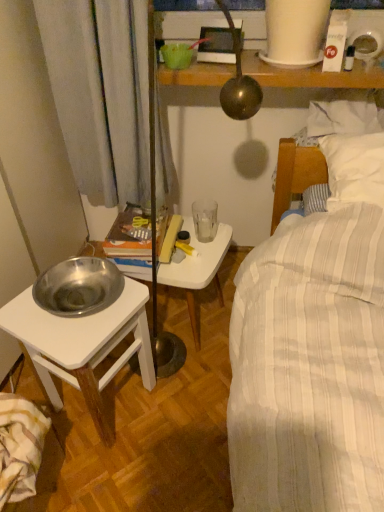
Question: Does white plastic table at center have a lesser width compared to striped cotton blanket at lower left?

Choices:
 (A) no
 (B) yes

Answer: (A)

Question: From the image's perspective, is white plastic table at center beneath striped cotton blanket at lower left?

Choices:
 (A) yes
 (B) no

Answer: (B)

Question: Does white plastic table at center have a lesser height compared to striped cotton blanket at lower left?

Choices:
 (A) yes
 (B) no

Answer: (B)

Question: Does white plastic table at center have a greater height compared to striped cotton blanket at lower left?

Choices:
 (A) no
 (B) yes

Answer: (B)

Question: Is white plastic table at center looking in the opposite direction of striped cotton blanket at lower left?

Choices:
 (A) yes
 (B) no

Answer: (B)

Question: Is white plastic table at center situated inside transparent glass at center or outside?

Choices:
 (A) outside
 (B) inside

Answer: (A)

Question: Considering the positions of white plastic table at center and transparent glass at center in the image, is white plastic table at center taller or shorter than transparent glass at center?

Choices:
 (A) short
 (B) tall

Answer: (B)

Question: Relative to transparent glass at center, is white plastic table at center in front or behind?

Choices:
 (A) front
 (B) behind

Answer: (A)

Question: From a real-world perspective, is white plastic table at center above or below transparent glass at center?

Choices:
 (A) below
 (B) above

Answer: (A)

Question: Looking at the image, does silver metallic bowl at left seem bigger or smaller compared to transparent glass at center?

Choices:
 (A) small
 (B) big

Answer: (B)

Question: Considering their positions, is silver metallic bowl at left located in front of or behind transparent glass at center?

Choices:
 (A) behind
 (B) front

Answer: (B)

Question: Do you think silver metallic bowl at left is within transparent glass at center, or outside of it?

Choices:
 (A) inside
 (B) outside

Answer: (B)

Question: Based on their positions, is silver metallic bowl at left located to the left or right of transparent glass at center?

Choices:
 (A) right
 (B) left

Answer: (B)

Question: From the image's perspective, is transparent glass at center positioned above or below striped cotton blanket at lower left?

Choices:
 (A) below
 (B) above

Answer: (B)

Question: Visually, is transparent glass at center positioned to the left or to the right of striped cotton blanket at lower left?

Choices:
 (A) right
 (B) left

Answer: (A)